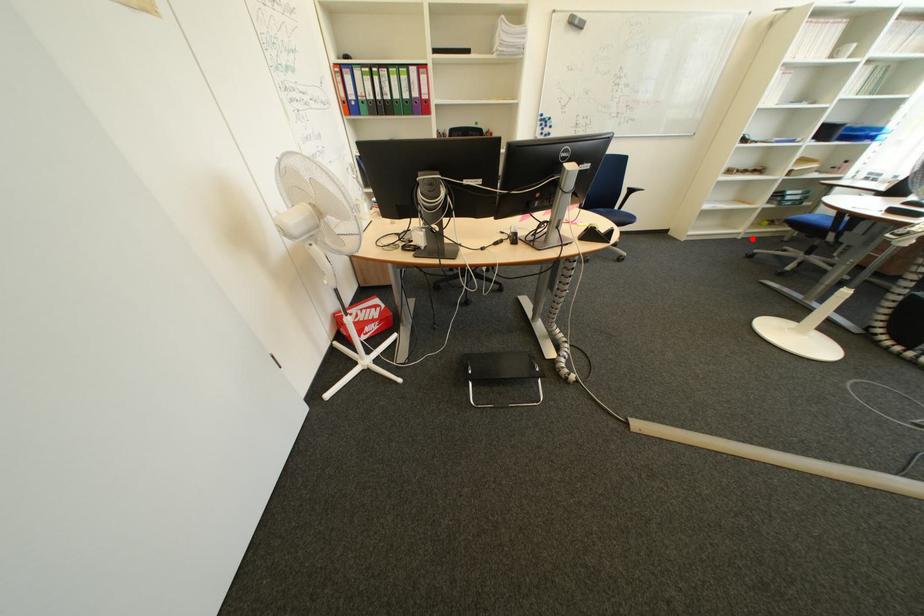
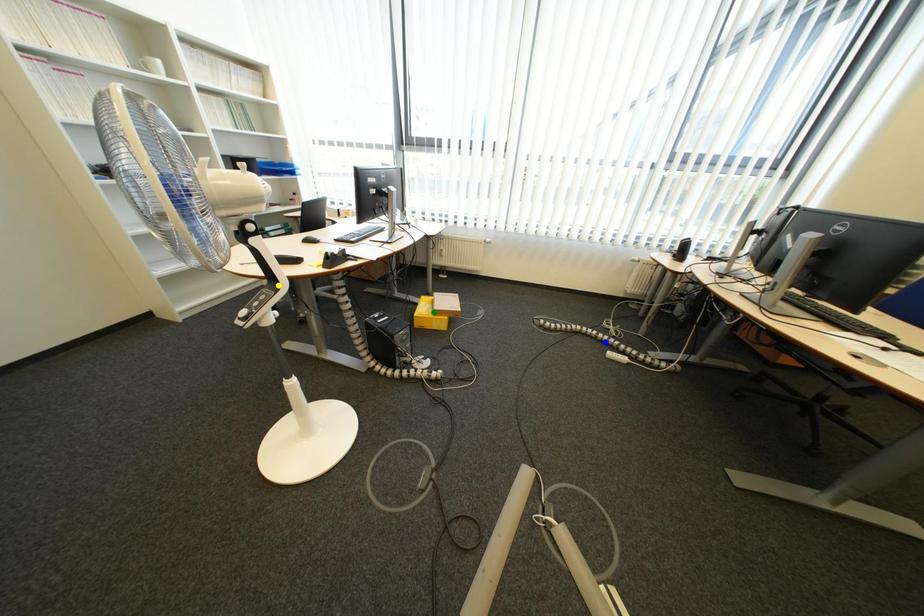
Question: I am providing you with two images of the same scene from different viewpoints. A red point is marked on the first image. You are given multiple points on the second image. In image 2, which mark is for the same physical point as the one in image 1?

Choices:
 (A) green point
 (B) blue point
 (C) yellow point

Answer: (C)